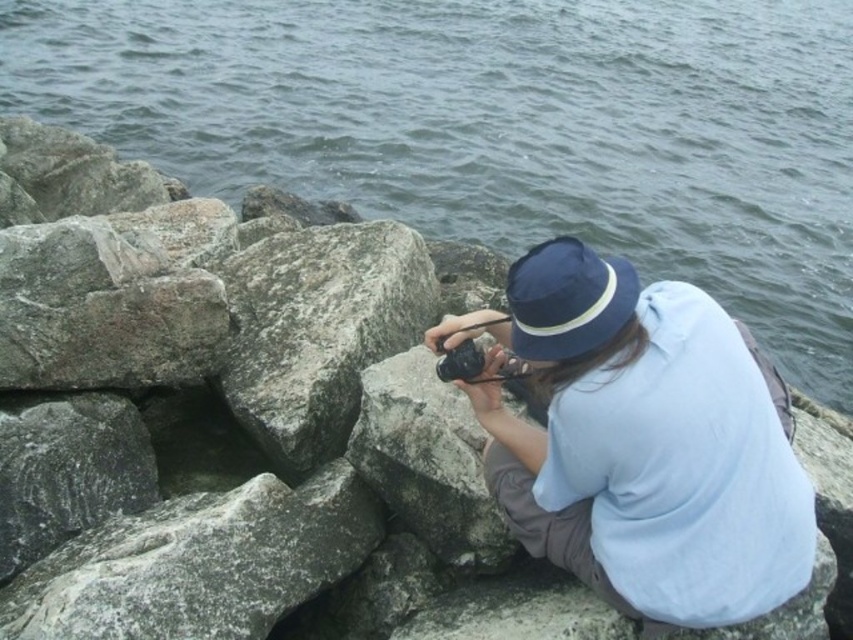
Question: Among these points, which one is farthest from the camera?

Choices:
 (A) (256, 608)
 (B) (512, 346)
 (C) (323, 257)
 (D) (120, 17)

Answer: (D)

Question: Can you confirm if gray water at upper center is bigger than gray rough stone at lower left?

Choices:
 (A) no
 (B) yes

Answer: (B)

Question: Can you confirm if gray rough rock at center is positioned to the right of blue fabric hat at upper center?

Choices:
 (A) yes
 (B) no

Answer: (B)

Question: Which point is closer to the camera?

Choices:
 (A) (126, 532)
 (B) (241, 288)
 (C) (190, 115)

Answer: (A)

Question: Which object is farther from the camera taking this photo?

Choices:
 (A) gray water at upper center
 (B) gray rough rock at center
 (C) blue fabric hat at center

Answer: (A)

Question: In this image, where is blue fabric hat at center located relative to blue fabric hat at upper center?

Choices:
 (A) below
 (B) above

Answer: (A)